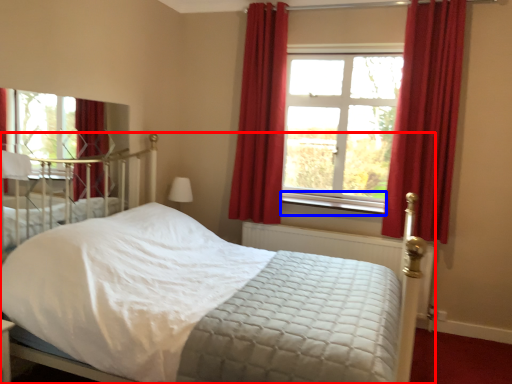
Question: Among these objects, which one is farthest to the camera, bed (highlighted by a red box) or window sill (highlighted by a blue box)?

Choices:
 (A) bed
 (B) window sill

Answer: (B)